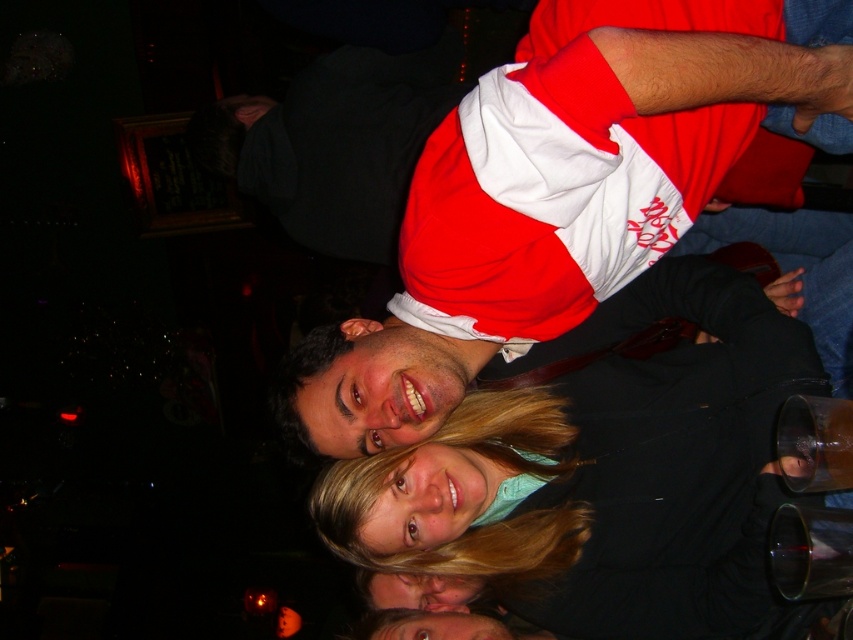
Question: Among these objects, which one is nearest to the camera?

Choices:
 (A) red and white jersey at center
 (B) matte black jacket at center

Answer: (A)

Question: Is matte black jacket at center further to camera compared to red and white jersey at center?

Choices:
 (A) no
 (B) yes

Answer: (B)

Question: Is matte black jacket at center bigger than red and white jersey at center?

Choices:
 (A) no
 (B) yes

Answer: (A)

Question: Observing the image, what is the correct spatial positioning of matte black jacket at center in reference to red and white jersey at center?

Choices:
 (A) right
 (B) left

Answer: (A)